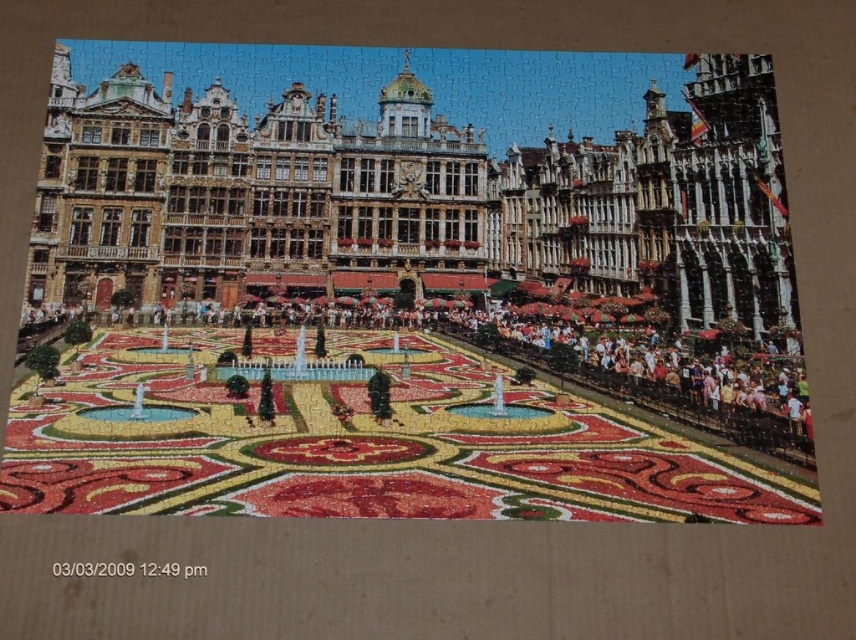
You are standing in front of the completed jigsaw puzzle and want to place a small figurine exactly at the center of the golden stone palace at upper center. According to the puzzle layout, where should you place the figurine?

The golden stone palace at upper center is located at point (411,198), so you should place the figurine at those coordinates to position it exactly at the center of the golden stone palace at upper center.

You are a tourist standing in front of the golden stone palace at upper center and the floral carpet at center in the Grand Place in Brussels. You want to take a photo of both objects in the same frame. Since your camera has a limited zoom, which object should you focus on first to ensure both are in the frame?

You should focus on the golden stone palace at upper center first because it is taller than the floral carpet at center, so capturing its full height will naturally include the floral carpet at center in the frame.